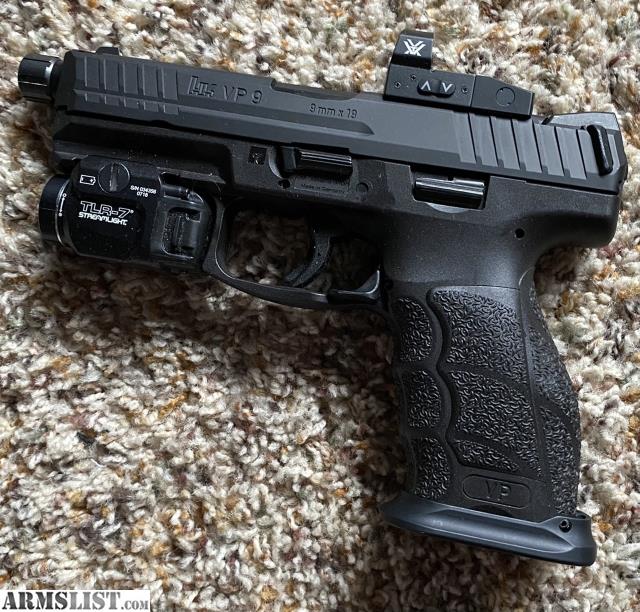
Find the location of a particular element. This screenshot has height=612, width=640. carpet is located at coordinates (268, 491).